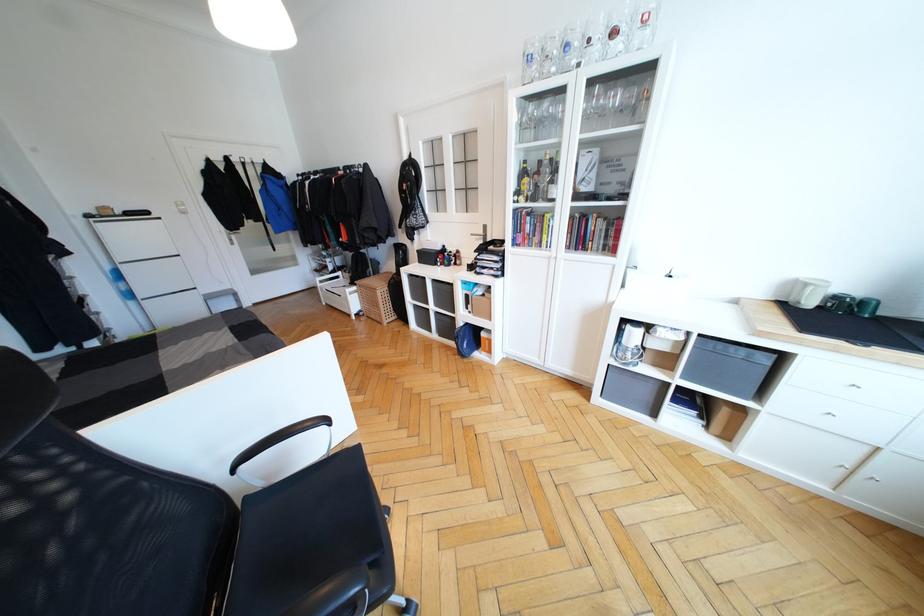
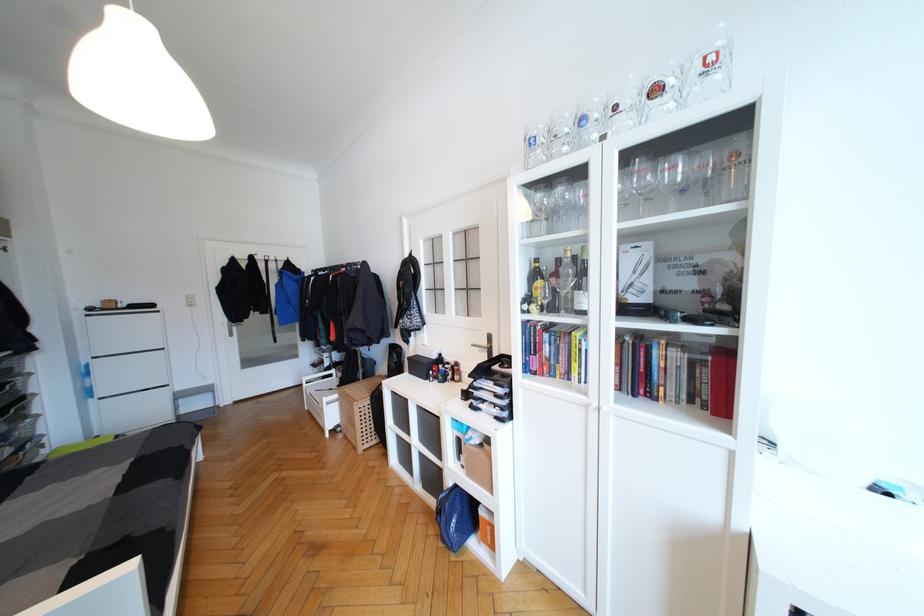
Find the pixel in the second image that matches pixel 521 193 in the first image.

(531, 301)